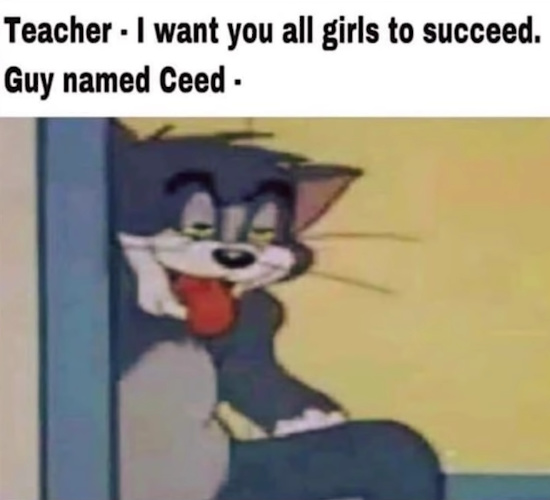
Locate an element on the screen. This screenshot has height=500, width=550. blue floor is located at coordinates (486, 490).